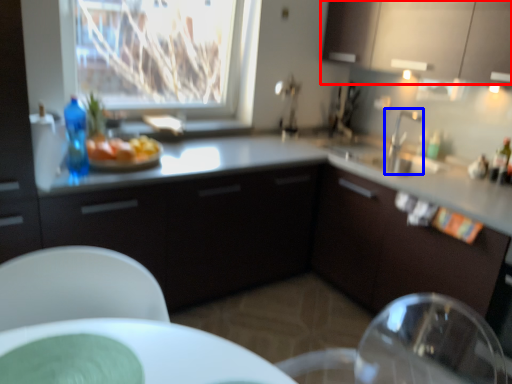
Question: Which object appears farthest to the camera in this image, cabinetry (highlighted by a red box) or tap (highlighted by a blue box)?

Choices:
 (A) cabinetry
 (B) tap

Answer: (B)